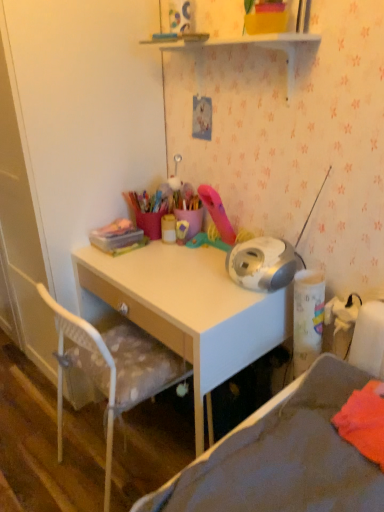
Question: Can you confirm if white glossy shelf at upper center is bigger than matte yellow container at center, positioned as the 1th stationery in right-to-left order?

Choices:
 (A) yes
 (B) no

Answer: (A)

Question: Can you confirm if white glossy shelf at upper center is positioned to the left of matte yellow container at center, the 2th stationery from the left?

Choices:
 (A) no
 (B) yes

Answer: (A)

Question: From a real-world perspective, is white glossy shelf at upper center located beneath matte yellow container at center, the 2th stationery from the left?

Choices:
 (A) yes
 (B) no

Answer: (B)

Question: Could matte yellow container at center, positioned as the 1th stationery in right-to-left order, be considered to be inside white glossy shelf at upper center?

Choices:
 (A) yes
 (B) no

Answer: (B)

Question: Does white glossy shelf at upper center have a lesser height compared to matte yellow container at center, the 2th stationery from the left?

Choices:
 (A) yes
 (B) no

Answer: (B)

Question: From a real-world perspective, is white glossy shelf at upper center over matte yellow container at center, the 2th stationery from the left?

Choices:
 (A) yes
 (B) no

Answer: (A)

Question: Would you say light wood desk at center is part of translucent plastic container at upper left, which appears as the 2th stationery when viewed from the right,'s contents?

Choices:
 (A) no
 (B) yes

Answer: (A)

Question: Can you confirm if translucent plastic container at upper left, the 1th stationery when ordered from left to right, is shorter than light wood desk at center?

Choices:
 (A) no
 (B) yes

Answer: (B)

Question: Is the position of translucent plastic container at upper left, which appears as the 2th stationery when viewed from the right, more distant than that of light wood desk at center?

Choices:
 (A) yes
 (B) no

Answer: (A)

Question: Can you confirm if translucent plastic container at upper left, the 1th stationery when ordered from left to right, is wider than light wood desk at center?

Choices:
 (A) no
 (B) yes

Answer: (A)

Question: Can you confirm if translucent plastic container at upper left, which appears as the 2th stationery when viewed from the right, is positioned to the right of light wood desk at center?

Choices:
 (A) yes
 (B) no

Answer: (B)

Question: From the image's perspective, is translucent plastic container at upper left, the 1th stationery when ordered from left to right, above light wood desk at center?

Choices:
 (A) no
 (B) yes

Answer: (B)

Question: Is white glossy shelf at upper center at the left side of gray fabric bed at lower right?

Choices:
 (A) no
 (B) yes

Answer: (B)